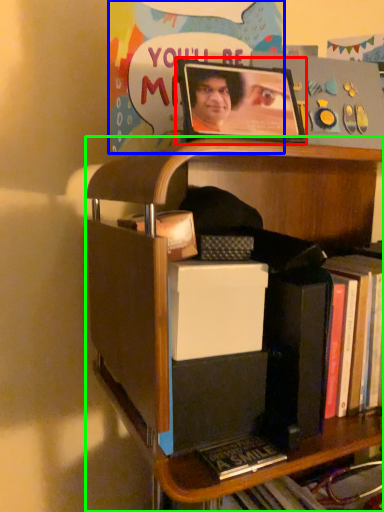
Question: Considering the real-world distances, which object is closest to picture frame (highlighted by a red box)? postcard (highlighted by a blue box) or shelf (highlighted by a green box).

Choices:
 (A) postcard
 (B) shelf

Answer: (A)